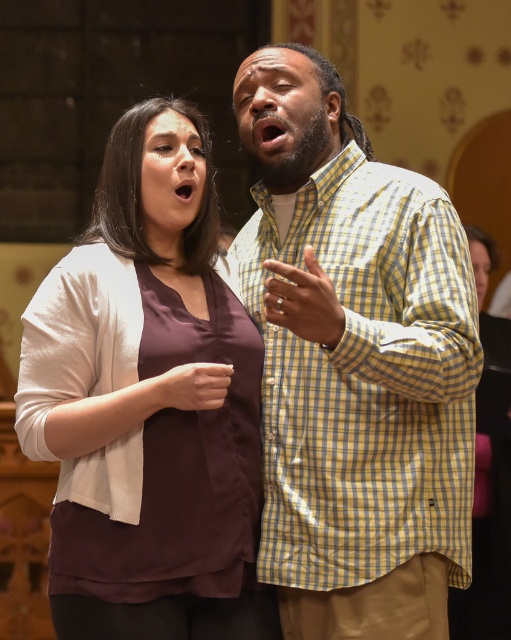
Between yellow checkered shirt at center and matte brown blouse at center, which one is positioned higher?

matte brown blouse at center

Is yellow checkered shirt at center closer to camera compared to matte brown blouse at center?

Yes, yellow checkered shirt at center is closer to the viewer.

The height and width of the screenshot is (640, 511). Identify the location of yellow checkered shirt at center. (355, 364).